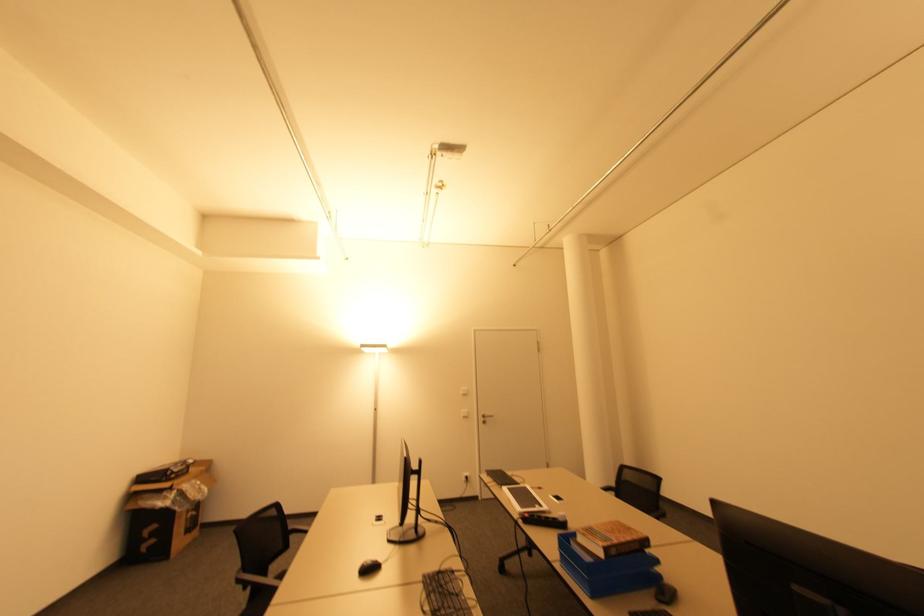
Locate an element on the screen. silver door handle is located at coordinates (492, 424).